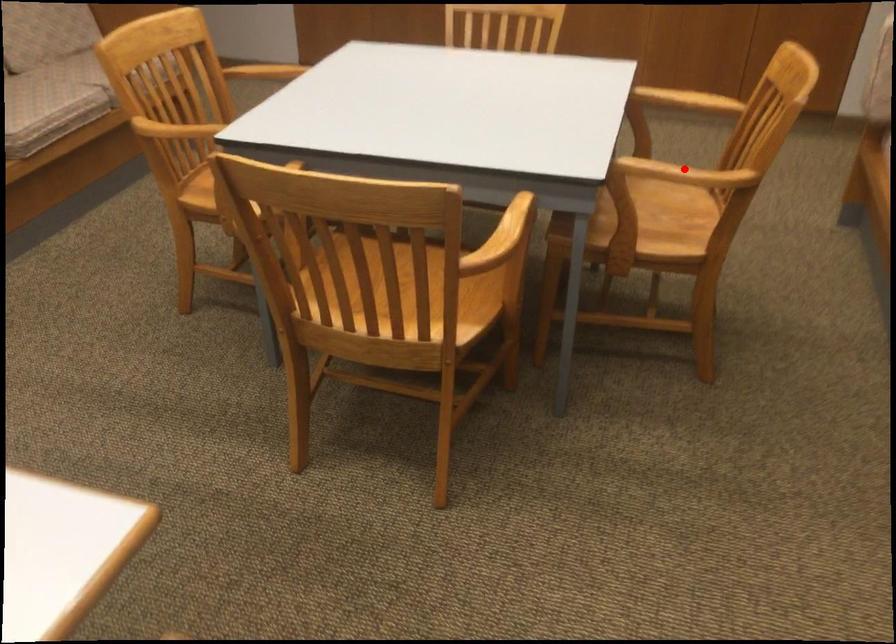
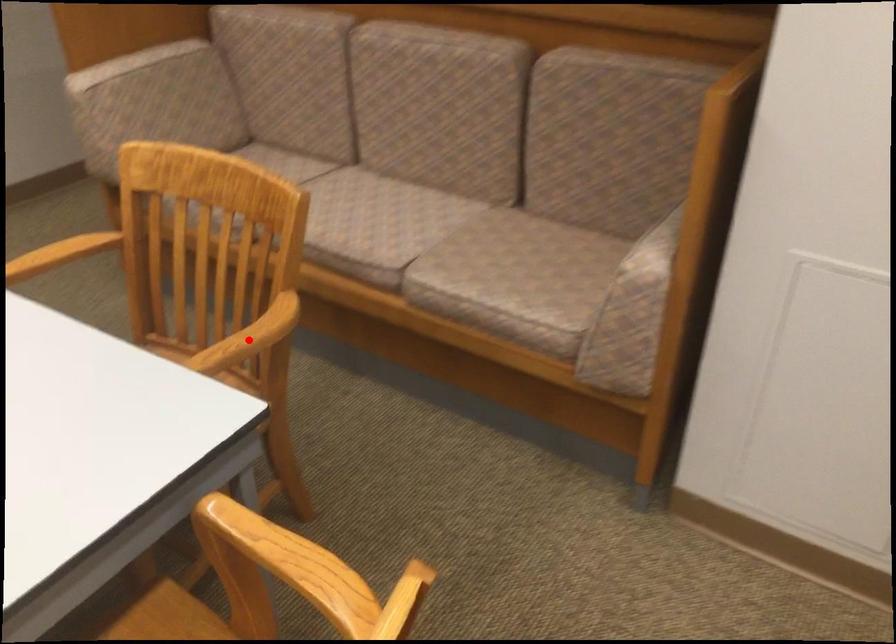
I am providing you with two images of the same scene from different viewpoints. A red point is marked on the first image and another point is marked on the second image. Is the red point in image1 aligned with the point shown in image2?

Yes